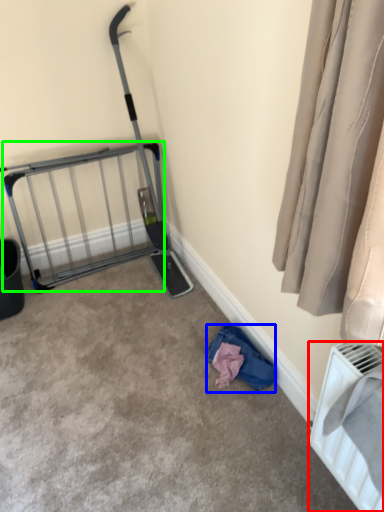
Question: Estimate the real-world distances between objects in this image. Which object is farther from radiator (highlighted by a red box), clothing (highlighted by a blue box) or cage (highlighted by a green box)?

Choices:
 (A) clothing
 (B) cage

Answer: (B)